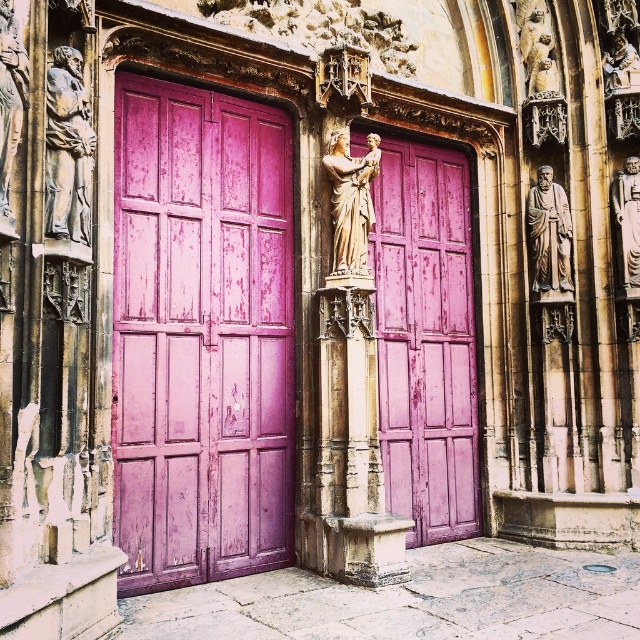
Question: From the image, what is the correct spatial relationship of stone statue at right in relation to gold statue at upper right?

Choices:
 (A) right
 (B) left

Answer: (B)

Question: Which object is closer to the camera taking this photo?

Choices:
 (A) carved stone figure at left
 (B) gold statue at left
 (C) polished stone statue at right

Answer: (B)

Question: Can you confirm if golden stone statue at upper right is bigger than gold statue at upper right?

Choices:
 (A) no
 (B) yes

Answer: (B)

Question: Among these objects, which one is farthest from the camera?

Choices:
 (A) stone statue at right
 (B) gold statue at left
 (C) gold statue at upper right
 (D) matte pink wood door at center

Answer: (C)

Question: Is purple matte wood door at left bigger than stone statue at right?

Choices:
 (A) no
 (B) yes

Answer: (B)

Question: Based on their relative distances, which object is nearer to the matte pink wood door at center?

Choices:
 (A) purple matte wood door at left
 (B) carved stone figure at left

Answer: (A)